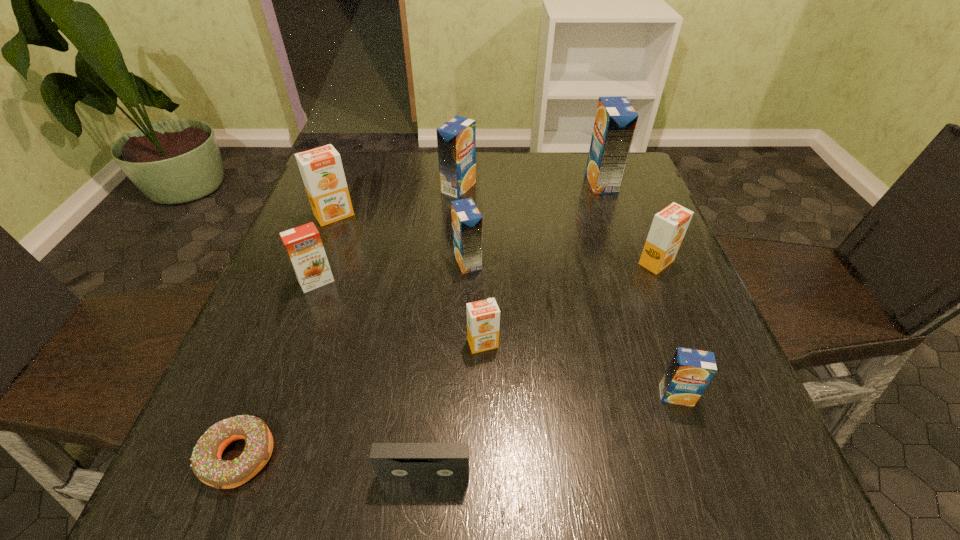
Locate an element on the screen. The height and width of the screenshot is (540, 960). the third orange orange juice from left to right is located at coordinates (483, 317).

You are a GUI agent. You are given a task and a screenshot of the screen. Output one action in this format:
    pyautogui.click(x=<x>, y=<y>)
    Task: Click on the ninth tallest object
    The width and height of the screenshot is (960, 540).
    Given the screenshot: What is the action you would take?
    pyautogui.click(x=393, y=462)

In order to click on the shortest object in this screenshot , I will do 207,465.

Where is `doughnut`? doughnut is located at coordinates (207, 465).

Where is `free region located 0.050m on the front of the tallest orange juice`? free region located 0.050m on the front of the tallest orange juice is located at coordinates click(x=610, y=205).

The image size is (960, 540). What are the coordinates of `free space located 0.110m on the front of the third smallest blue orange_juice` in the screenshot? It's located at (456, 225).

Identify the location of vacant area situated 0.160m on the front of the farthest orange orange juice. Image resolution: width=960 pixels, height=540 pixels. (312, 273).

Where is `vacant space located on the left of the second smallest blue orange_juice`? This screenshot has width=960, height=540. vacant space located on the left of the second smallest blue orange_juice is located at coordinates (386, 261).

The height and width of the screenshot is (540, 960). Find the location of `free spot located on the left of the rightmost orange orange juice`. free spot located on the left of the rightmost orange orange juice is located at coordinates [611, 262].

Find the location of `free point located 0.060m on the back of the nearest blue orange_juice`. free point located 0.060m on the back of the nearest blue orange_juice is located at coordinates (662, 355).